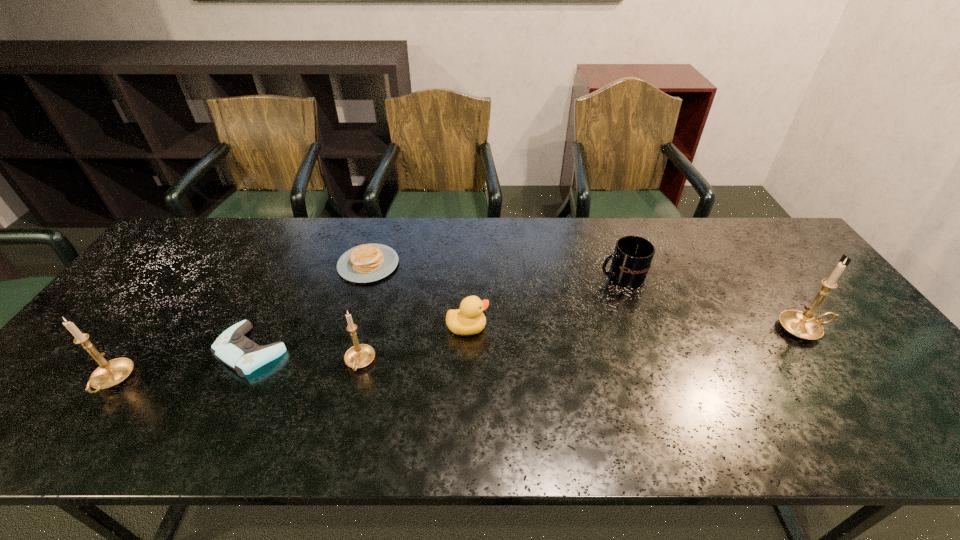
Locate an element on the screen. This screenshot has height=540, width=960. object at the left edge is located at coordinates (110, 373).

Identify the location of object that is at the right edge. (803, 325).

Find the location of a particular element. This screenshot has width=960, height=540. object positioned at the near left corner is located at coordinates (110, 373).

The width and height of the screenshot is (960, 540). What are the coordinates of `vacant space at the far edge` in the screenshot? It's located at click(x=472, y=258).

This screenshot has width=960, height=540. In order to click on free space at the near edge in this screenshot , I will do `click(279, 402)`.

Where is `vacant point at the left edge`? This screenshot has height=540, width=960. vacant point at the left edge is located at coordinates (112, 332).

Image resolution: width=960 pixels, height=540 pixels. In order to click on free space at the far right corner in this screenshot , I will do `click(764, 252)`.

Find the location of a particular element. The image size is (960, 540). free location at the near right corner is located at coordinates (849, 395).

This screenshot has height=540, width=960. I want to click on empty location between the mug and the fifth shortest object, so click(x=491, y=320).

Identify the location of vacant region between the second tallest object and the rightmost object. The width and height of the screenshot is (960, 540). (458, 355).